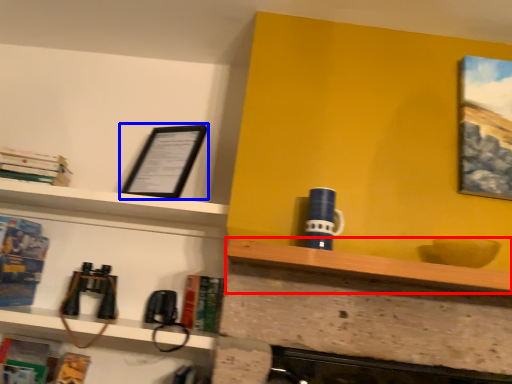
Question: Which point is closer to the camera, shelf (highlighted by a red box) or picture frame (highlighted by a blue box)?

Choices:
 (A) shelf
 (B) picture frame

Answer: (A)